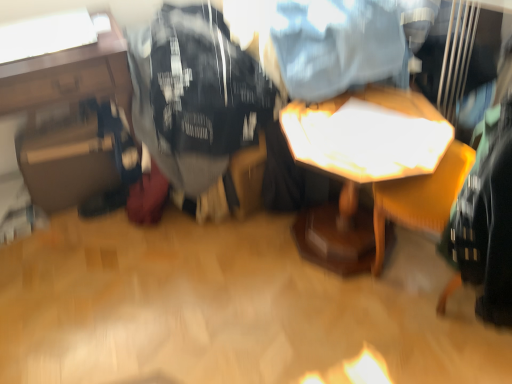
At what (x,y) coordinates should I click in order to perform the action: click on free point above wooden table at center, the second table in the left-to-right sequence (from a real-world perspective). Please return your answer as a coordinate pair (x, y). The width and height of the screenshot is (512, 384). Looking at the image, I should click on (359, 134).